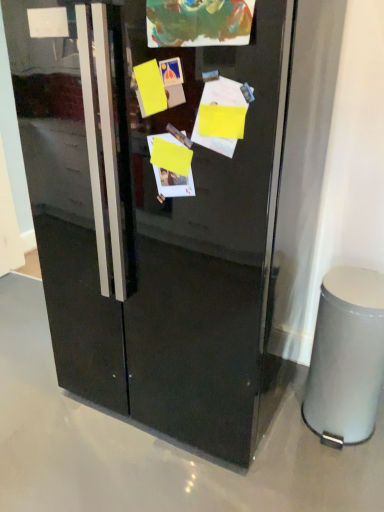
I want to click on glossy black refrigerator at center, so click(156, 227).

Describe the element at coordinates (156, 227) in the screenshot. I see `glossy black refrigerator at center` at that location.

Measure the distance between point (x=176, y=221) and camera.

Point (x=176, y=221) is 1.29 meters away from camera.

Measure the distance between glossy black refrigerator at center and camera.

The depth of glossy black refrigerator at center is 95.11 centimeters.

I want to click on silver metallic trash bin at lower right, so click(x=346, y=357).

This screenshot has width=384, height=512. Describe the element at coordinates (346, 357) in the screenshot. I see `silver metallic trash bin at lower right` at that location.

Identify the location of glossy black refrigerator at center. (156, 227).

Is glossy black refrigerator at center to the right of silver metallic trash bin at lower right from the viewer's perspective?

In fact, glossy black refrigerator at center is to the left of silver metallic trash bin at lower right.

Is glossy black refrigerator at center closer to the viewer compared to silver metallic trash bin at lower right?

Yes, it is.

Considering the points (271, 224) and (383, 311), which point is behind, point (271, 224) or point (383, 311)?

Point (383, 311)

From the image's perspective, is glossy black refrigerator at center on top of silver metallic trash bin at lower right?

Yes.

From a real-world perspective, does glossy black refrigerator at center stand above silver metallic trash bin at lower right?

Yes, from a real-world perspective, glossy black refrigerator at center is on top of silver metallic trash bin at lower right.

Considering the relative sizes of glossy black refrigerator at center and silver metallic trash bin at lower right in the image provided, is glossy black refrigerator at center thinner than silver metallic trash bin at lower right?

No.

Considering the relative sizes of glossy black refrigerator at center and silver metallic trash bin at lower right in the image provided, is glossy black refrigerator at center taller than silver metallic trash bin at lower right?

Yes, glossy black refrigerator at center is taller than silver metallic trash bin at lower right.

Can you confirm if glossy black refrigerator at center is bigger than silver metallic trash bin at lower right?

Yes, glossy black refrigerator at center is bigger than silver metallic trash bin at lower right.

Is glossy black refrigerator at center situated inside silver metallic trash bin at lower right or outside?

glossy black refrigerator at center is spatially situated outside silver metallic trash bin at lower right.

Is glossy black refrigerator at center far from silver metallic trash bin at lower right?

A: No, glossy black refrigerator at center is in close proximity to silver metallic trash bin at lower right.

Does glossy black refrigerator at center turn towards silver metallic trash bin at lower right?

No.

Measure the distance from glossy black refrigerator at center to silver metallic trash bin at lower right.

They are 24.76 inches apart.

Find the location of a particular element. Image resolution: width=384 pixels, height=512 pixels. trash bin/can on the right of glossy black refrigerator at center is located at coordinates (346, 357).

From the picture: Is silver metallic trash bin at lower right at the left side of glossy black refrigerator at center?

No, silver metallic trash bin at lower right is not to the left of glossy black refrigerator at center.

Considering the positions of objects silver metallic trash bin at lower right and glossy black refrigerator at center in the image provided, who is in front, silver metallic trash bin at lower right or glossy black refrigerator at center?

glossy black refrigerator at center is closer to the camera.

Which is behind, point (371, 321) or point (148, 200)?

The point (371, 321) is behind.

From the image's perspective, which one is positioned higher, silver metallic trash bin at lower right or glossy black refrigerator at center?

glossy black refrigerator at center.

From a real-world perspective, is silver metallic trash bin at lower right physically located above or below glossy black refrigerator at center?

In terms of real-world spatial position, silver metallic trash bin at lower right is below glossy black refrigerator at center.

Can you confirm if silver metallic trash bin at lower right is wider than glossy black refrigerator at center?

In fact, silver metallic trash bin at lower right might be narrower than glossy black refrigerator at center.

Looking at this image, considering the sizes of silver metallic trash bin at lower right and glossy black refrigerator at center in the image, is silver metallic trash bin at lower right taller or shorter than glossy black refrigerator at center?

silver metallic trash bin at lower right is shorter than glossy black refrigerator at center.

Between silver metallic trash bin at lower right and glossy black refrigerator at center, which one has larger size?

glossy black refrigerator at center.

Is silver metallic trash bin at lower right located outside glossy black refrigerator at center?

Absolutely, silver metallic trash bin at lower right is external to glossy black refrigerator at center.

Is silver metallic trash bin at lower right positioned far away from glossy black refrigerator at center?

That's not correct — silver metallic trash bin at lower right is a little close to glossy black refrigerator at center.

Is silver metallic trash bin at lower right looking in the opposite direction of glossy black refrigerator at center?

No, glossy black refrigerator at center is not at the back of silver metallic trash bin at lower right.

What's the angular difference between silver metallic trash bin at lower right and glossy black refrigerator at center's facing directions?

They differ by 0.858 degrees in their facing directions.

The height and width of the screenshot is (512, 384). I want to click on trash bin/can located on the right of glossy black refrigerator at center, so click(346, 357).

Find the location of a particular element. The image size is (384, 512). trash bin/can below the glossy black refrigerator at center (from the image's perspective) is located at coordinates (346, 357).

Where is `refrigerator lying in front of the silver metallic trash bin at lower right`? Image resolution: width=384 pixels, height=512 pixels. refrigerator lying in front of the silver metallic trash bin at lower right is located at coordinates (156, 227).